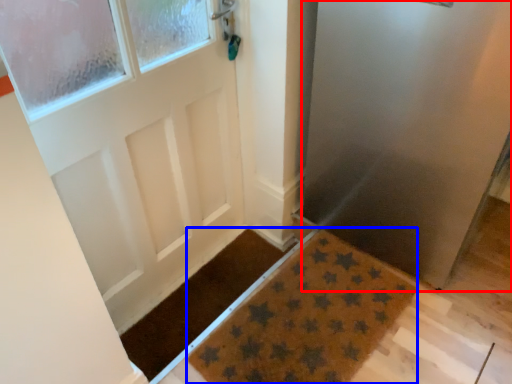
Question: Which object appears farthest to the camera in this image, screen door (highlighted by a red box) or doormat (highlighted by a blue box)?

Choices:
 (A) screen door
 (B) doormat

Answer: (B)